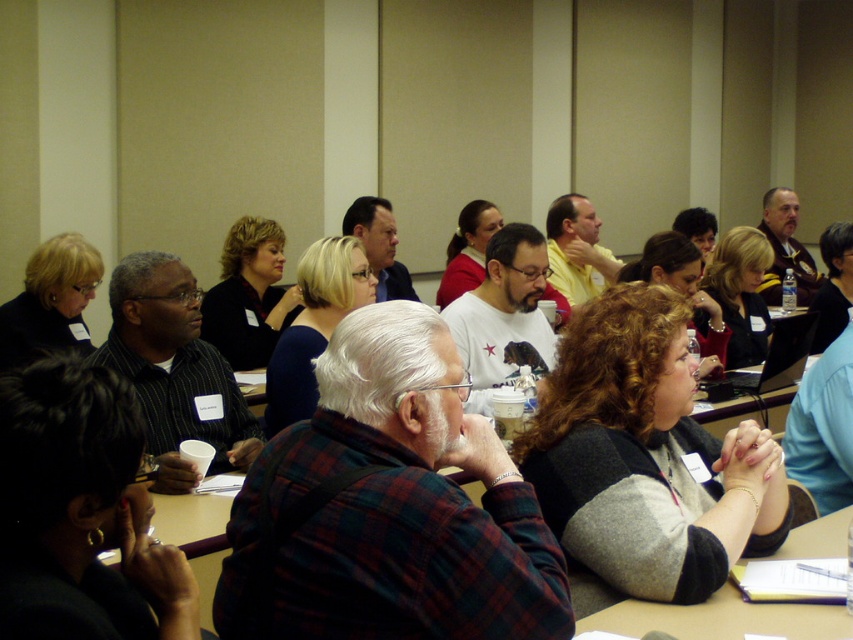
You are standing in the conference room and want to move from the point at coordinates point (250,336) to the point at coordinates point (735,346). Can you walk directly between them without any obstacles?

Point (250,336) is behind point (735,346), so you cannot walk directly between them without going around the obstacle in front.

You are a photographer taking a photo of the conference room scene. You notice the matte black sweater at upper left and the blonde hair at center. Which object should you focus on first to ensure both are in sharp focus?

You should focus on the matte black sweater at upper left first because it is closer to the viewer than the blonde hair at center. By focusing on the closer object, the depth of field may still keep the farther object in acceptable focus.

You are organizing a photo shoot and need to ensure that the black sweater at center and the blonde hair at center are visible in the frame. Based on their sizes, which object should you focus on to ensure both are captured clearly?

The black sweater at center has a larger width than the blonde hair at center, so focusing on the black sweater at center would help ensure both are visible in the frame since it takes up more space.